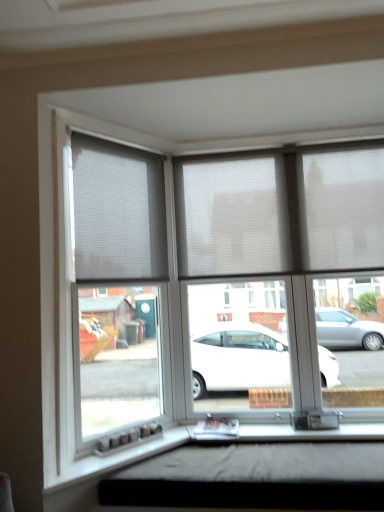
Question: Is white pleated blind at upper left shorter than black matte window box at lower center?

Choices:
 (A) no
 (B) yes

Answer: (A)

Question: Is white pleated blind at upper left to the right of black matte window box at lower center from the viewer's perspective?

Choices:
 (A) yes
 (B) no

Answer: (B)

Question: From a real-world perspective, does white pleated blind at upper left stand above black matte window box at lower center?

Choices:
 (A) yes
 (B) no

Answer: (A)

Question: Is white pleated blind at upper left located outside black matte window box at lower center?

Choices:
 (A) no
 (B) yes

Answer: (B)

Question: Is white pleated blind at upper left aimed at black matte window box at lower center?

Choices:
 (A) no
 (B) yes

Answer: (A)

Question: Can you confirm if white pleated blind at upper left is smaller than black matte window box at lower center?

Choices:
 (A) yes
 (B) no

Answer: (A)

Question: From the image's perspective, would you say black matte window box at lower center is positioned over white pleated blinds at center?

Choices:
 (A) no
 (B) yes

Answer: (A)

Question: Is black matte window box at lower center looking in the opposite direction of white pleated blinds at center?

Choices:
 (A) yes
 (B) no

Answer: (B)

Question: From a real-world perspective, is black matte window box at lower center positioned over white pleated blinds at center based on gravity?

Choices:
 (A) no
 (B) yes

Answer: (A)

Question: Does black matte window box at lower center have a lesser width compared to white pleated blinds at center?

Choices:
 (A) no
 (B) yes

Answer: (A)

Question: Is white pleated blinds at center completely or partially inside black matte window box at lower center?

Choices:
 (A) no
 (B) yes

Answer: (A)

Question: Is black matte window box at lower center touching white pleated blinds at center?

Choices:
 (A) no
 (B) yes

Answer: (A)

Question: Could you tell me if white pleated blind at upper left is facing white pleated blinds at center?

Choices:
 (A) yes
 (B) no

Answer: (B)